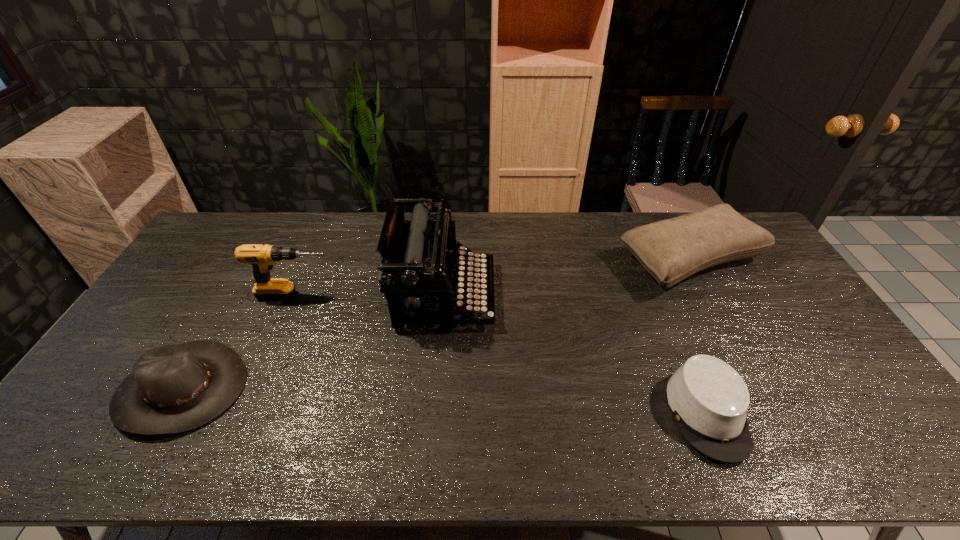
The image size is (960, 540). Find the location of `vacant area that lies between the shorter hat and the third shortest object`. vacant area that lies between the shorter hat and the third shortest object is located at coordinates (699, 337).

This screenshot has width=960, height=540. Identify the location of the third closest object relative to the cushion. (262, 258).

This screenshot has width=960, height=540. I want to click on object that can be found as the second closest to the third tallest object, so click(x=418, y=255).

Where is `free region that satisfies the following two spatial constraints: 1. on the typing side of the tallest object; 2. on the front-facing side of the taller hat`? free region that satisfies the following two spatial constraints: 1. on the typing side of the tallest object; 2. on the front-facing side of the taller hat is located at coordinates (437, 389).

The image size is (960, 540). What are the coordinates of `free region that satisfies the following two spatial constraints: 1. at the tip of the drill; 2. on the front-facing side of the fourth tallest object` in the screenshot? It's located at (256, 389).